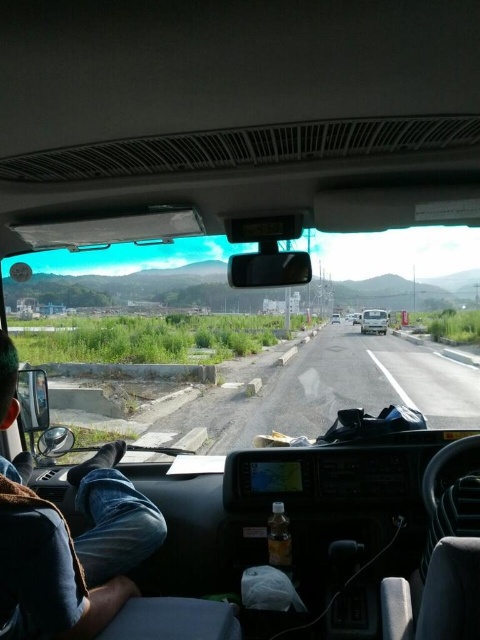
Question: Can you confirm if gravel road at center is thinner than white matte van at center?

Choices:
 (A) yes
 (B) no

Answer: (B)

Question: Is jeans at lower left in front of gravel road at center?

Choices:
 (A) no
 (B) yes

Answer: (B)

Question: Which point is farther to the camera?

Choices:
 (A) (398, 392)
 (B) (36, 598)

Answer: (A)

Question: Which point is farther from the camera taking this photo?

Choices:
 (A) (117, 497)
 (B) (364, 314)
 (C) (319, 364)
 (D) (331, 317)

Answer: (D)

Question: Can you confirm if white matte van at center is positioned below white glossy car at center?

Choices:
 (A) no
 (B) yes

Answer: (B)

Question: Which point appears closest to the camera in this image?

Choices:
 (A) 339,321
 (B) 384,323
 (C) 81,616

Answer: (C)